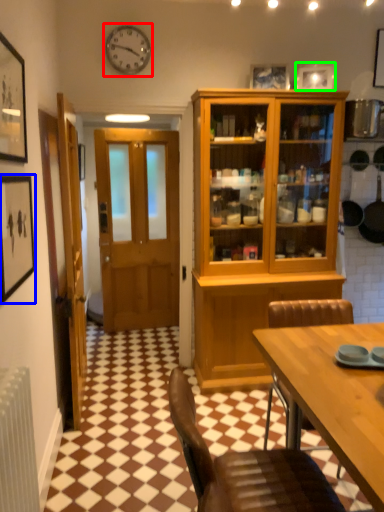
Question: Which object is the closest to the clock (highlighted by a red box)? Choose among these: picture frame (highlighted by a blue box) or picture frame (highlighted by a green box).

Choices:
 (A) picture frame
 (B) picture frame

Answer: (B)